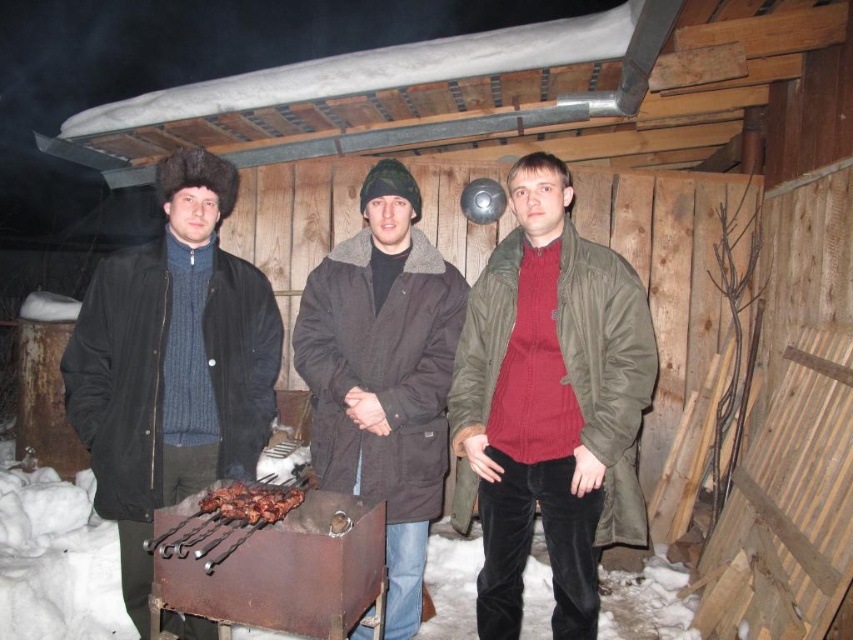
Question: Can you confirm if olive green jacket at center is thinner than brown charred skewers at center?

Choices:
 (A) yes
 (B) no

Answer: (B)

Question: Which point is farther to the camera?

Choices:
 (A) dark brown fur hat at left
 (B) brown charred skewers at center
 (C) olive green jacket at center
 (D) dark brown fur-lined coat at center

Answer: (A)

Question: Which object appears closest to the camera in this image?

Choices:
 (A) dark brown fur hat at left
 (B) olive green jacket at center

Answer: (B)

Question: Can you confirm if olive green jacket at center is positioned to the right of dark brown fur-lined coat at center?

Choices:
 (A) yes
 (B) no

Answer: (A)

Question: Considering the real-world distances, which object is farthest from the dark brown fur-lined coat at center?

Choices:
 (A) dark brown fur hat at left
 (B) olive green jacket at center
 (C) brown charred skewers at center

Answer: (A)

Question: Can you confirm if dark brown fur hat at left is positioned to the left of dark brown fur-lined coat at center?

Choices:
 (A) no
 (B) yes

Answer: (B)